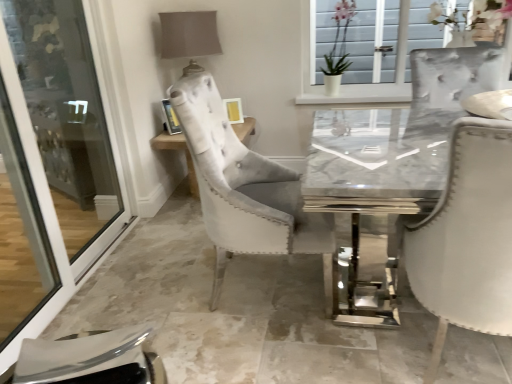
The height and width of the screenshot is (384, 512). What do you see at coordinates (178, 149) in the screenshot?
I see `marble table at center` at bounding box center [178, 149].

Find the location of a particular element. This screenshot has height=384, width=512. white glossy vase at upper center is located at coordinates (338, 38).

From the picture: Which point is more distant from viewer, (194,186) or (165,114)?

The point (194,186) is more distant.

Which of these two, marble table at center or metallic silver picture frame at upper center, is smaller?

metallic silver picture frame at upper center.

Is marble table at center not close to metallic silver picture frame at upper center?

No, marble table at center is not far from metallic silver picture frame at upper center.

Is marble table at center to the left of metallic silver picture frame at upper center from the viewer's perspective?

No, marble table at center is not to the left of metallic silver picture frame at upper center.

Consider the image. In terms of size, does marble table at center appear bigger or smaller than white glossy vase at upper center?

Considering their sizes, marble table at center takes up more space than white glossy vase at upper center.

Is marble table at center far away from white glossy vase at upper center?

Absolutely, marble table at center is distant from white glossy vase at upper center.

From the image's perspective, which object appears higher, marble table at center or white glossy vase at upper center?

white glossy vase at upper center appears higher in the image.

How many degrees apart are the facing directions of white glossy vase at upper center and metallic silver picture frame at upper center?

39.7 degrees separate the facing orientations of white glossy vase at upper center and metallic silver picture frame at upper center.

Based on the photo, relative to metallic silver picture frame at upper center, is white glossy vase at upper center in front or behind?

white glossy vase at upper center is behind metallic silver picture frame at upper center.

Is there a large distance between white glossy vase at upper center and metallic silver picture frame at upper center?

Yes, white glossy vase at upper center is far from metallic silver picture frame at upper center.

Considering the sizes of white glossy vase at upper center and metallic silver picture frame at upper center in the image, is white glossy vase at upper center bigger or smaller than metallic silver picture frame at upper center?

In the image, white glossy vase at upper center appears to be larger than metallic silver picture frame at upper center.

Is transparent glass screen door at left with white glossy vase at upper center?

No, transparent glass screen door at left is not next to white glossy vase at upper center.

From a real-world perspective, is transparent glass screen door at left over white glossy vase at upper center?

Incorrect, from a real-world perspective, transparent glass screen door at left is lower than white glossy vase at upper center.

Could you tell me if transparent glass screen door at left is turned towards white glossy vase at upper center?

No, transparent glass screen door at left does not turn towards white glossy vase at upper center.

How many degrees apart are the facing directions of transparent glass screen door at left and white glossy vase at upper center?

The facing directions of transparent glass screen door at left and white glossy vase at upper center are 90.1 degrees apart.

Choose the correct answer: Is metallic silver picture frame at upper center inside white glossy vase at upper center or outside it?

metallic silver picture frame at upper center lies outside white glossy vase at upper center.

How far apart are metallic silver picture frame at upper center and white glossy vase at upper center?

metallic silver picture frame at upper center is 1.33 meters away from white glossy vase at upper center.

Between metallic silver picture frame at upper center and white glossy vase at upper center, which one has larger size?

white glossy vase at upper center is bigger.

Is metallic silver picture frame at upper center next to white glossy vase at upper center?

metallic silver picture frame at upper center is not next to white glossy vase at upper center, and they're not touching.

Can you confirm if white glossy vase at upper center is smaller than marble table at center?

Indeed, white glossy vase at upper center has a smaller size compared to marble table at center.

Between white glossy vase at upper center and marble table at center, which one is positioned in front?

marble table at center is more forward.

From a real-world perspective, who is located higher, white glossy vase at upper center or marble table at center?

white glossy vase at upper center, from a real-world perspective.

Could marble table at center be considered to be inside white glossy vase at upper center?

No, marble table at center is not inside white glossy vase at upper center.

How many degrees apart are the facing directions of marble table at center and transparent glass screen door at left?

They differ by 91.4 degrees in their facing directions.

Who is smaller, marble table at center or transparent glass screen door at left?

Smaller between the two is transparent glass screen door at left.

From the image's perspective, which is above, marble table at center or transparent glass screen door at left?

marble table at center.

Is marble table at center not close to transparent glass screen door at left?

They are positioned close to each other.

I want to click on picture frame on the left of marble table at center, so click(170, 118).

You are a GUI agent. You are given a task and a screenshot of the screen. Output one action in this format:
    pyautogui.click(x=<x>, y=<y>)
    Task: Click on the flower that is behind the marble table at center
    
    Given the screenshot: What is the action you would take?
    pyautogui.click(x=338, y=38)

Estimate the real-world distances between objects in this image. Which object is further from white glossy vase at upper center, marble table at center or metallic silver picture frame at upper center?

marble table at center is further to white glossy vase at upper center.

From the image, which object appears to be farther from marble table at center, transparent glass screen door at left or white glossy vase at upper center?

white glossy vase at upper center.

Based on their spatial positions, is transparent glass screen door at left or metallic silver picture frame at upper center further from white glossy vase at upper center?

Among the two, transparent glass screen door at left is located further to white glossy vase at upper center.

From the image, which object appears to be farther from metallic silver picture frame at upper center, marble table at center or white glossy vase at upper center?

Based on the image, white glossy vase at upper center appears to be further to metallic silver picture frame at upper center.

Estimate the real-world distances between objects in this image. Which object is closer to transparent glass screen door at left, metallic silver picture frame at upper center or white glossy vase at upper center?

metallic silver picture frame at upper center.

Which object lies further to the anchor point marble table at center, metallic silver picture frame at upper center or white glossy vase at upper center?

white glossy vase at upper center is further to marble table at center.

Estimate the real-world distances between objects in this image. Which object is further from metallic silver picture frame at upper center, white glossy vase at upper center or marble table at center?

white glossy vase at upper center is positioned further to the anchor metallic silver picture frame at upper center.

From the image, which object appears to be nearer to white glossy vase at upper center, metallic silver picture frame at upper center or marble table at center?

metallic silver picture frame at upper center.

Image resolution: width=512 pixels, height=384 pixels. In order to click on picture frame positioned between transparent glass screen door at left and white glossy vase at upper center from near to far in this screenshot , I will do (x=170, y=118).

You are a GUI agent. You are given a task and a screenshot of the screen. Output one action in this format:
    pyautogui.click(x=<x>, y=<y>)
    Task: Click on the table positioned between transparent glass screen door at left and white glossy vase at upper center from near to far
    This screenshot has height=384, width=512.
    Given the screenshot: What is the action you would take?
    pyautogui.click(x=178, y=149)

The image size is (512, 384). Identify the location of table between metallic silver picture frame at upper center and white glossy vase at upper center in the horizontal direction. (178, 149).

Image resolution: width=512 pixels, height=384 pixels. Find the location of `table between transparent glass screen door at left and metallic silver picture frame at upper center along the z-axis`. table between transparent glass screen door at left and metallic silver picture frame at upper center along the z-axis is located at coordinates (178, 149).